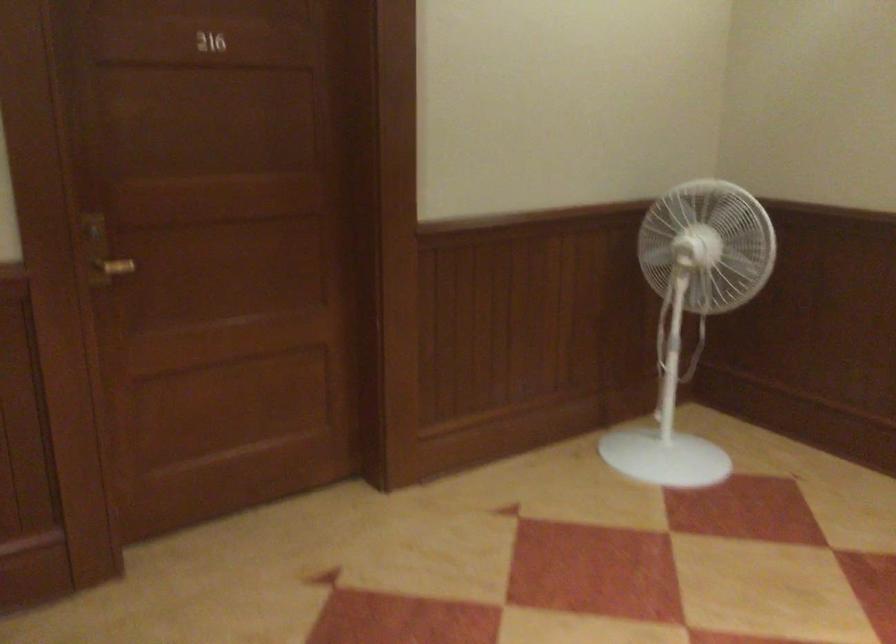
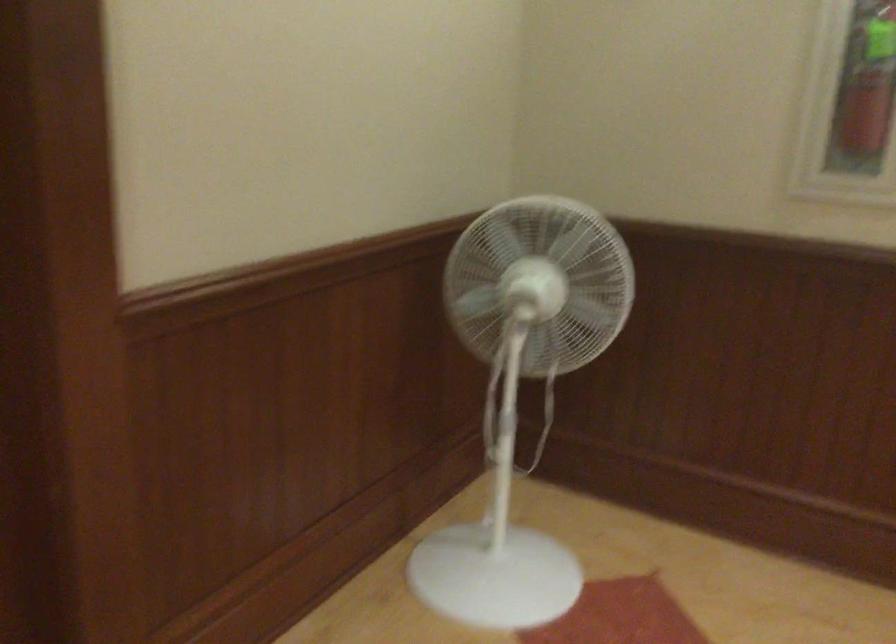
Question: Which direction would the cameraman need to move to produce the second image? Reply with the corresponding letter.

Choices:
 (A) Left
 (B) Right
 (C) Forward
 (D) Backward

Answer: (C)